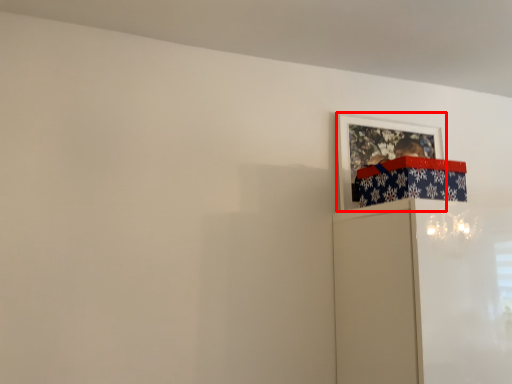
Question: From the image's perspective, what is the correct spatial relationship of picture frame (annotated by the red box) in relation to wrapping paper?

Choices:
 (A) above
 (B) below

Answer: (A)